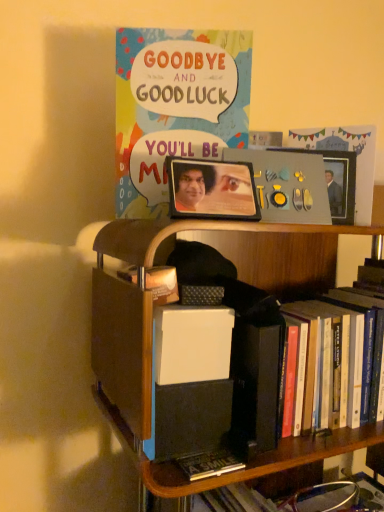
Question: Is metallic silver picture frame at upper right, the 2th picture frame positioned from the left, smaller than metallic photo frame at center, placed as the first picture frame when sorted from front to back?

Choices:
 (A) no
 (B) yes

Answer: (B)

Question: Does metallic silver picture frame at upper right, the first picture frame in the right-to-left sequence, have a lesser height compared to metallic photo frame at center, the 2th picture frame in the back-to-front sequence?

Choices:
 (A) yes
 (B) no

Answer: (B)

Question: From a real-world perspective, is metallic silver picture frame at upper right, the first picture frame in the right-to-left sequence, located beneath metallic photo frame at center, acting as the 1th picture frame starting from the left?

Choices:
 (A) yes
 (B) no

Answer: (B)

Question: Is metallic silver picture frame at upper right, acting as the 1th picture frame starting from the back, wider than metallic photo frame at center, the 2th picture frame when ordered from right to left?

Choices:
 (A) yes
 (B) no

Answer: (B)

Question: From the image's perspective, would you say metallic silver picture frame at upper right, the second picture frame when ordered from front to back, is shown under metallic photo frame at center, the 2th picture frame when ordered from right to left?

Choices:
 (A) yes
 (B) no

Answer: (B)

Question: Is metallic silver picture frame at upper right, the 2th picture frame positioned from the left, aimed at metallic photo frame at center, the 2th picture frame when ordered from right to left?

Choices:
 (A) yes
 (B) no

Answer: (A)

Question: Is metallic silver picture frame at upper right, the first picture frame in the right-to-left sequence, further to the viewer compared to matte paper comic book at upper center?

Choices:
 (A) yes
 (B) no

Answer: (A)

Question: Considering the relative sizes of metallic silver picture frame at upper right, the second picture frame when ordered from front to back, and matte paper comic book at upper center in the image provided, is metallic silver picture frame at upper right, the second picture frame when ordered from front to back, bigger than matte paper comic book at upper center?

Choices:
 (A) no
 (B) yes

Answer: (A)

Question: Considering the relative sizes of metallic silver picture frame at upper right, acting as the 1th picture frame starting from the back, and matte paper comic book at upper center in the image provided, is metallic silver picture frame at upper right, acting as the 1th picture frame starting from the back, thinner than matte paper comic book at upper center?

Choices:
 (A) no
 (B) yes

Answer: (B)

Question: Is metallic silver picture frame at upper right, acting as the 1th picture frame starting from the back, oriented away from matte paper comic book at upper center?

Choices:
 (A) no
 (B) yes

Answer: (A)

Question: Does metallic silver picture frame at upper right, the first picture frame in the right-to-left sequence, have a greater width compared to matte paper comic book at upper center?

Choices:
 (A) no
 (B) yes

Answer: (A)

Question: Can you confirm if metallic silver picture frame at upper right, the second picture frame when ordered from front to back, is smaller than matte paper comic book at upper center?

Choices:
 (A) yes
 (B) no

Answer: (A)

Question: From a real-world perspective, is wooden bookcase at center physically above metallic silver picture frame at upper right, the 2th picture frame positioned from the left?

Choices:
 (A) yes
 (B) no

Answer: (B)